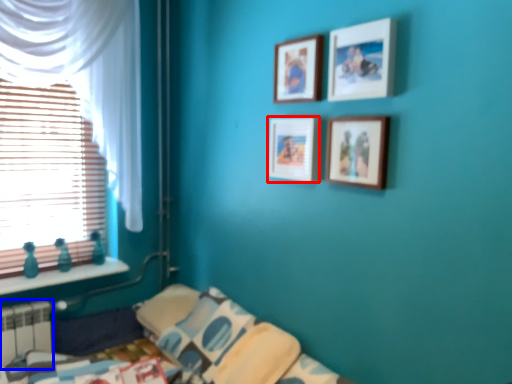
Question: Which of the following is the closest to the observer, picture frame (highlighted by a red box) or radiator (highlighted by a blue box)?

Choices:
 (A) picture frame
 (B) radiator

Answer: (A)